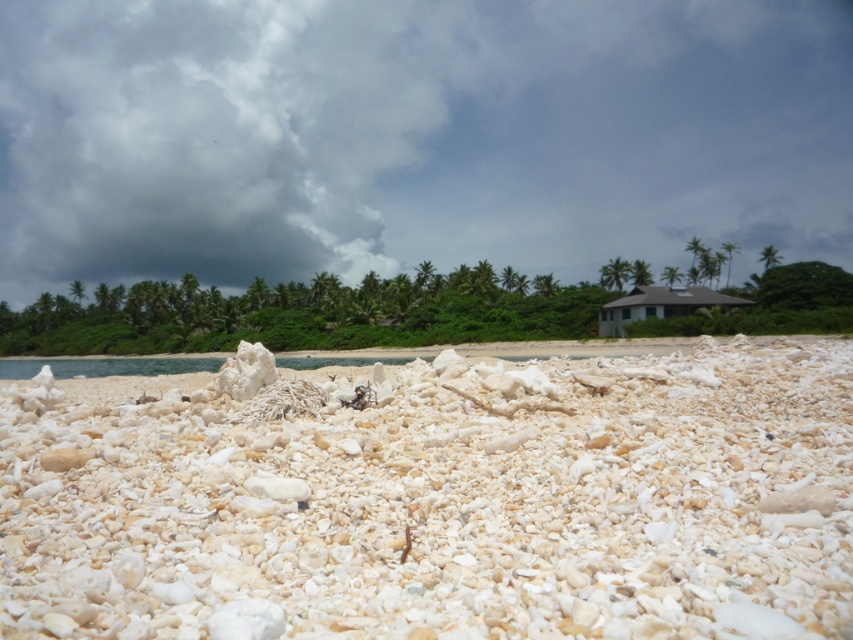
Between cloudy sky at upper center and white gravel at center, which one is positioned lower?

white gravel at center is below.

Does cloudy sky at upper center appear on the left side of white gravel at center?

Correct, you'll find cloudy sky at upper center to the left of white gravel at center.

Image resolution: width=853 pixels, height=640 pixels. Identify the location of cloudy sky at upper center. (415, 136).